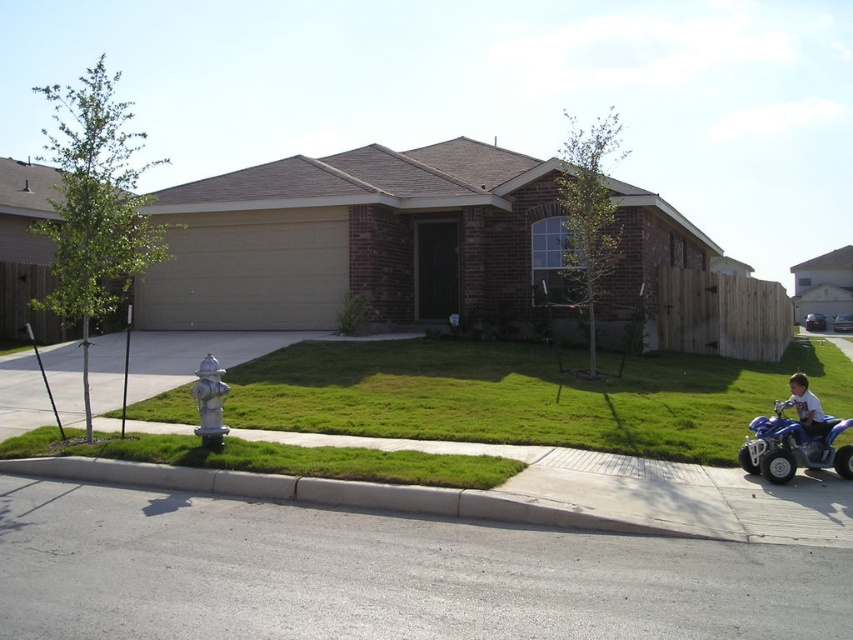
Question: Which of the following is the closest to the observer?

Choices:
 (A) green grass at lower center
 (B) blue plastic toy car at lower right
 (C) blue plastic quad bike at lower right
 (D) white matte toy at lower right

Answer: (A)

Question: Observing the image, what is the correct spatial positioning of green grass at center in reference to green grass at lower center?

Choices:
 (A) below
 (B) above

Answer: (B)

Question: Which point is closer to the camera?

Choices:
 (A) white matte toy at lower right
 (B) silver metallic fire hydrant at lower left

Answer: (A)

Question: Does white matte toy at lower right lie behind blue plastic toy car at lower right?

Choices:
 (A) yes
 (B) no

Answer: (B)

Question: Does green grass at center have a lesser width compared to white matte toy at lower right?

Choices:
 (A) yes
 (B) no

Answer: (B)

Question: Which object is farther from the camera taking this photo?

Choices:
 (A) green grass at lower center
 (B) silver metallic fire hydrant at lower left
 (C) white matte toy at lower right

Answer: (B)